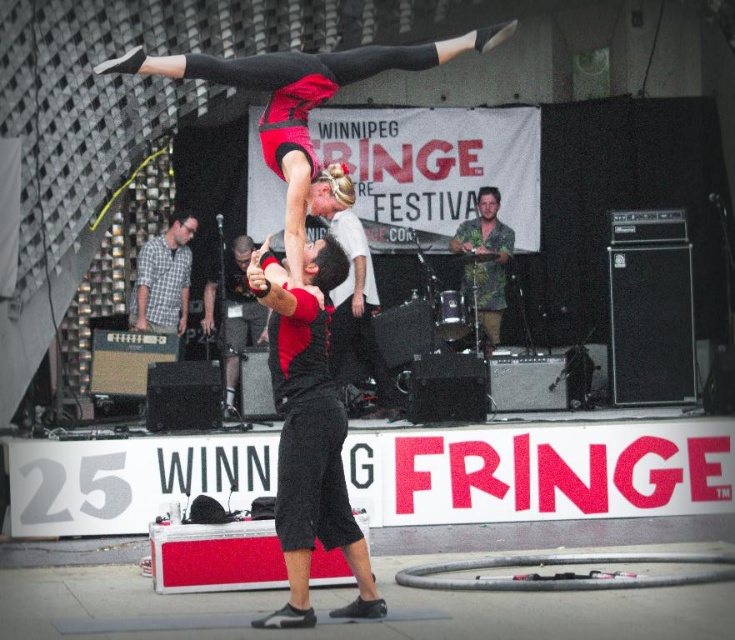
You are a photographer at the Winnipeg Fringe Festival capturing the acrobats. You notice the plaid shirt at center and the black matte shorts at center. Which object is closer to the camera?

The plaid shirt at center is closer to the camera because the black matte shorts at center is behind it.

You are a photographer at the Winnipeg Fringe Festival trying to capture the acrobats. You need to focus your camera on the plaid shirt at center and the black matte shorts at center. Which object should you adjust your focus to first if you want to capture both in sharp detail?

The plaid shirt at center is not as tall as black matte shorts at center, so you should focus on the plaid shirt at center first since it is closer to the camera.